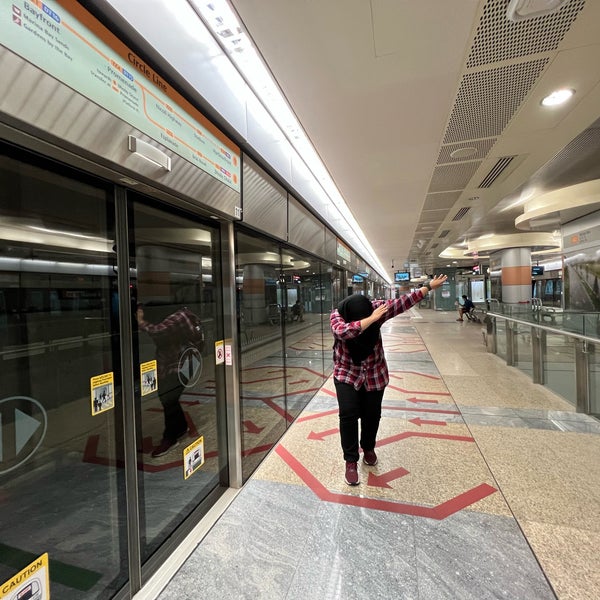
Image resolution: width=600 pixels, height=600 pixels. I want to click on light, so click(x=557, y=100), click(x=197, y=61), click(x=330, y=186), click(x=343, y=234).